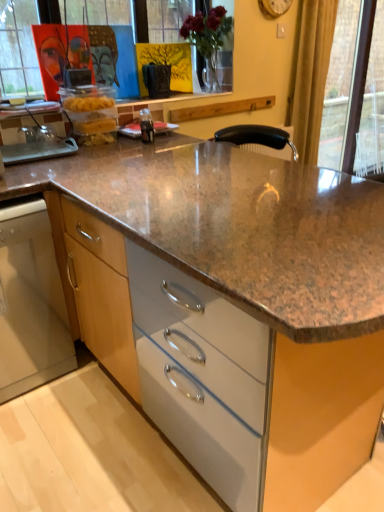
Question: Is gold textured curtain at right to the left of transparent glass door at upper right from the viewer's perspective?

Choices:
 (A) yes
 (B) no

Answer: (A)

Question: Is the position of gold textured curtain at right more distant than that of transparent glass door at upper right?

Choices:
 (A) no
 (B) yes

Answer: (A)

Question: Is gold textured curtain at right in front of transparent glass door at upper right?

Choices:
 (A) yes
 (B) no

Answer: (A)

Question: Can you confirm if gold textured curtain at right is thinner than transparent glass door at upper right?

Choices:
 (A) yes
 (B) no

Answer: (B)

Question: Is gold textured curtain at right outside of transparent glass door at upper right?

Choices:
 (A) no
 (B) yes

Answer: (B)

Question: From a real-world perspective, is satin stainless steel dishwasher at lower left above or below transparent glass door at upper right?

Choices:
 (A) above
 (B) below

Answer: (B)

Question: Is satin stainless steel dishwasher at lower left in front of or behind transparent glass door at upper right in the image?

Choices:
 (A) behind
 (B) front

Answer: (B)

Question: Looking at their shapes, would you say satin stainless steel dishwasher at lower left is wider or thinner than transparent glass door at upper right?

Choices:
 (A) wide
 (B) thin

Answer: (A)

Question: From the image's perspective, is satin stainless steel dishwasher at lower left positioned above or below transparent glass door at upper right?

Choices:
 (A) below
 (B) above

Answer: (A)

Question: Visually, is transparent glass door at upper right positioned to the left or to the right of satin stainless steel dishwasher at lower left?

Choices:
 (A) left
 (B) right

Answer: (B)

Question: Looking at the image, does transparent glass door at upper right seem bigger or smaller compared to satin stainless steel dishwasher at lower left?

Choices:
 (A) big
 (B) small

Answer: (B)

Question: Considering the positions of transparent glass door at upper right and satin stainless steel dishwasher at lower left in the image, is transparent glass door at upper right wider or thinner than satin stainless steel dishwasher at lower left?

Choices:
 (A) wide
 (B) thin

Answer: (B)

Question: From their relative heights in the image, would you say transparent glass door at upper right is taller or shorter than satin stainless steel dishwasher at lower left?

Choices:
 (A) tall
 (B) short

Answer: (A)

Question: Do you think transparent glass door at upper right is within gold textured curtain at right, or outside of it?

Choices:
 (A) outside
 (B) inside

Answer: (A)

Question: From a real-world perspective, is transparent glass door at upper right physically located above or below gold textured curtain at right?

Choices:
 (A) above
 (B) below

Answer: (B)